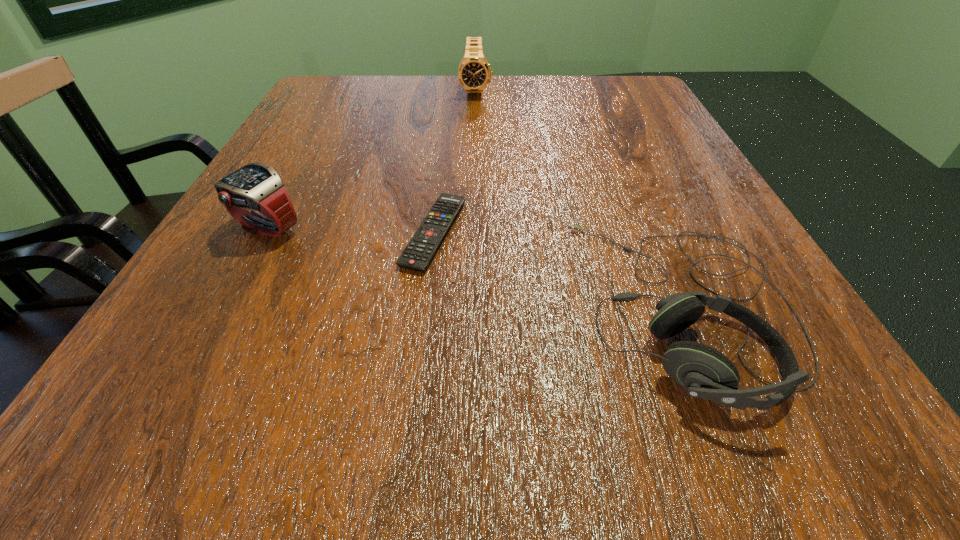
Locate an element on the screen. The height and width of the screenshot is (540, 960). the farther watch is located at coordinates (474, 72).

The width and height of the screenshot is (960, 540). What are the coordinates of `the farthest object` in the screenshot? It's located at (474, 72).

What are the coordinates of `the shorter watch` in the screenshot? It's located at (256, 187).

Where is `the left watch`? the left watch is located at coordinates (256, 187).

You are a GUI agent. You are given a task and a screenshot of the screen. Output one action in this format:
    pyautogui.click(x=<x>, y=<y>)
    Task: Click on the headset
    The width and height of the screenshot is (960, 540).
    Given the screenshot: What is the action you would take?
    pyautogui.click(x=704, y=372)

Locate an element on the screen. This screenshot has height=540, width=960. the shortest object is located at coordinates (422, 247).

You are a GUI agent. You are given a task and a screenshot of the screen. Output one action in this format:
    pyautogui.click(x=<x>, y=<y>)
    Task: Click on the vacant region located 0.140m on the face of the farther watch
    
    Given the screenshot: What is the action you would take?
    pyautogui.click(x=475, y=130)

You are a GUI agent. You are given a task and a screenshot of the screen. Output one action in this format:
    pyautogui.click(x=<x>, y=<y>)
    Task: Click on the vacant region located on the back of the shorter watch
    The width and height of the screenshot is (960, 540).
    Given the screenshot: What is the action you would take?
    pyautogui.click(x=291, y=185)

Find the location of a particular element. vacant region located 0.260m on the outer surface of the headset is located at coordinates (381, 306).

This screenshot has height=540, width=960. In order to click on free space located 0.300m on the outer surface of the headset in this screenshot , I will do `click(350, 306)`.